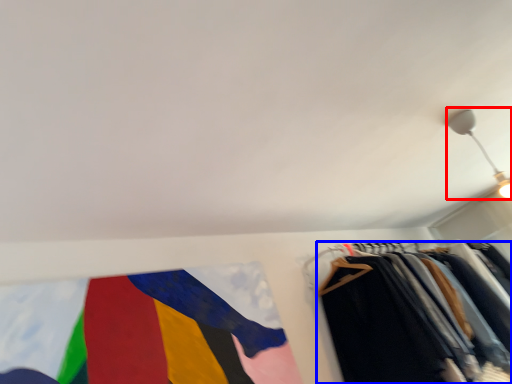
Question: Which object appears closest to the camera in this image, light fixture (highlighted by a red box) or trousers (highlighted by a blue box)?

Choices:
 (A) light fixture
 (B) trousers

Answer: (B)